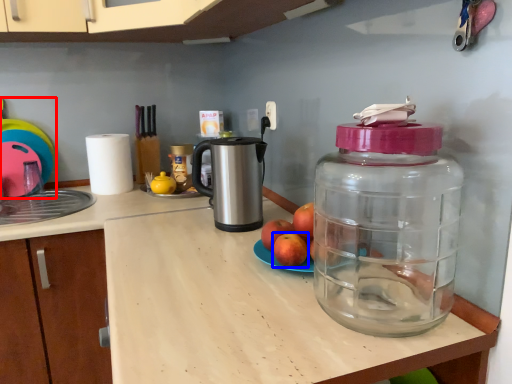
Question: Which of the following is the farthest to the observer, toy (highlighted by a red box) or apple (highlighted by a blue box)?

Choices:
 (A) toy
 (B) apple

Answer: (A)